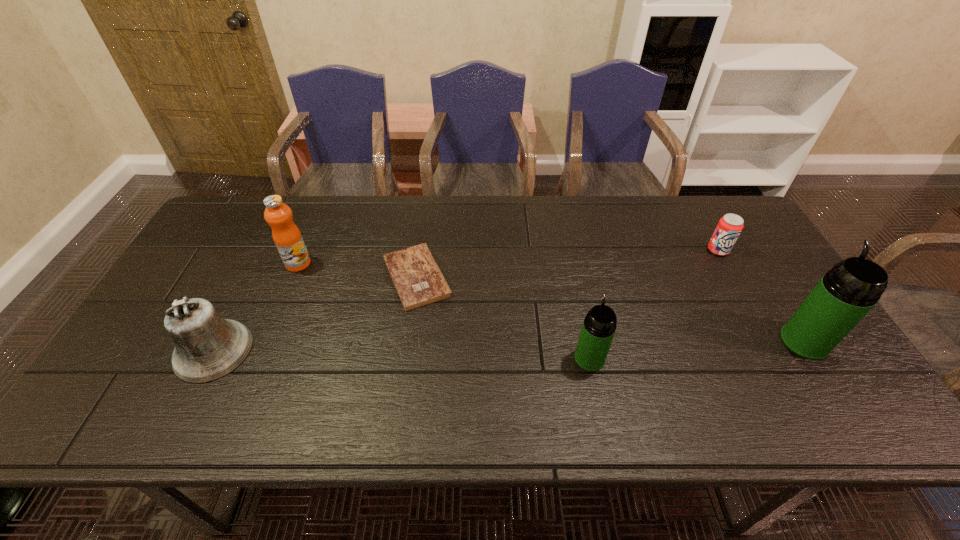
In order to click on blank space located 0.300m from the spout of the left thermos bottle in this screenshot , I will do `click(570, 262)`.

Find the location of a particular element. blank area located 0.080m from the spout of the left thermos bottle is located at coordinates (582, 321).

Find the location of a particular element. This screenshot has width=960, height=540. free space located from the spout of the left thermos bottle is located at coordinates (569, 260).

Locate an element on the screen. blank space located from the spout of the taller thermos bottle is located at coordinates (756, 262).

Locate an element on the screen. The width and height of the screenshot is (960, 540). vacant space situated 0.110m from the spout of the taller thermos bottle is located at coordinates (774, 293).

Identify the location of free space located 0.080m from the spout of the taller thermos bottle. (780, 301).

Find the location of a particular element. vacant space situated on the front of the fruit juice is located at coordinates (270, 334).

The image size is (960, 540). In order to click on free region located 0.220m on the surface of the fifth object from left to right in this screenshot , I will do `click(754, 314)`.

Find the location of a particular element. The image size is (960, 540). vacant space situated 0.210m on the right of the Bible is located at coordinates (526, 276).

The image size is (960, 540). In order to click on vacant space located on the right of the bell in this screenshot , I will do `click(340, 350)`.